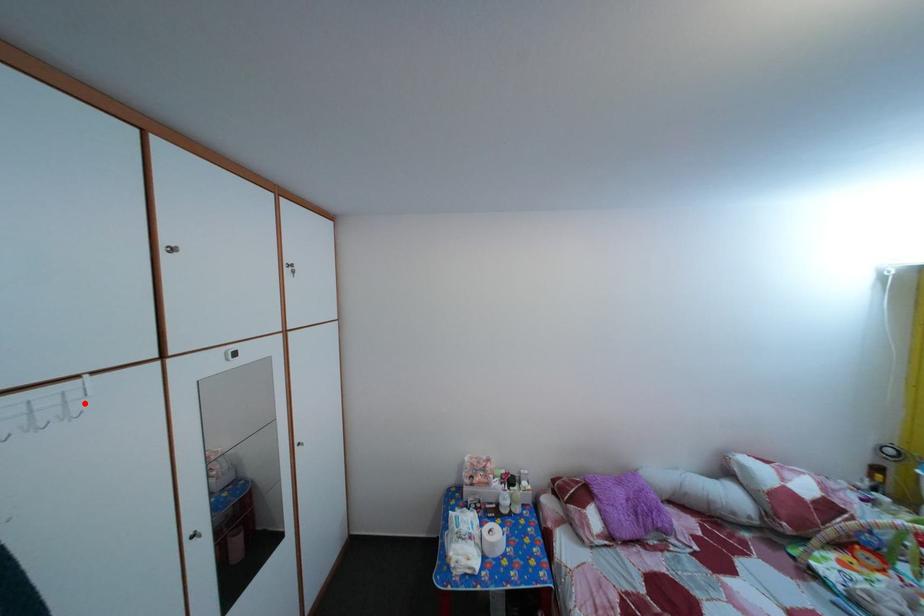
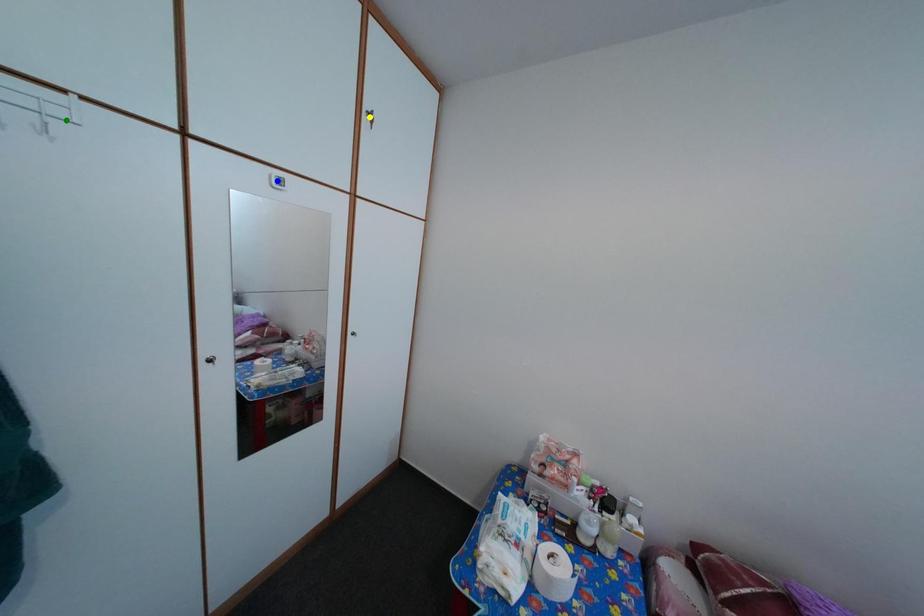
Question: I am providing you with two images of the same scene from different viewpoints. A red point is marked on the first image. You are given multiple points on the second image. Which spot in image 2 lines up with the point in image 1?

Choices:
 (A) yellow point
 (B) green point
 (C) blue point

Answer: (B)